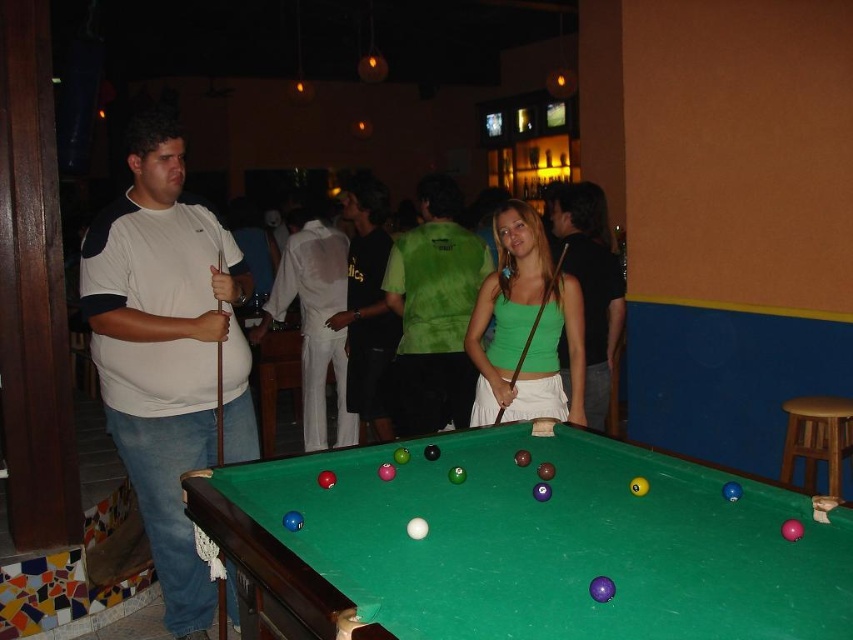
Is green matte tank top at center to the left of black smooth shirt at center from the viewer's perspective?

Yes, green matte tank top at center is to the left of black smooth shirt at center.

Does green matte tank top at center appear on the right side of black smooth shirt at center?

Incorrect, green matte tank top at center is not on the right side of black smooth shirt at center.

Who is more forward, (555, 406) or (567, 228)?

Point (555, 406)

You are a GUI agent. You are given a task and a screenshot of the screen. Output one action in this format:
    pyautogui.click(x=<x>, y=<y>)
    Task: Click on the green matte tank top at center
    
    Given the screenshot: What is the action you would take?
    pyautogui.click(x=525, y=328)

Which is above, green matte tank top at center or matte green tank top at center?

matte green tank top at center is above.

Is green matte tank top at center shorter than matte green tank top at center?

Indeed, green matte tank top at center has a lesser height compared to matte green tank top at center.

Is point (555, 326) more distant than point (457, 266)?

No, (555, 326) is in front of (457, 266).

This screenshot has height=640, width=853. In order to click on green matte tank top at center in this screenshot , I will do `click(525, 328)`.

Which of these two, white matte shirt at left or green matte tank top at center, stands shorter?

green matte tank top at center is shorter.

Locate an element on the screen. white matte shirt at left is located at coordinates (167, 352).